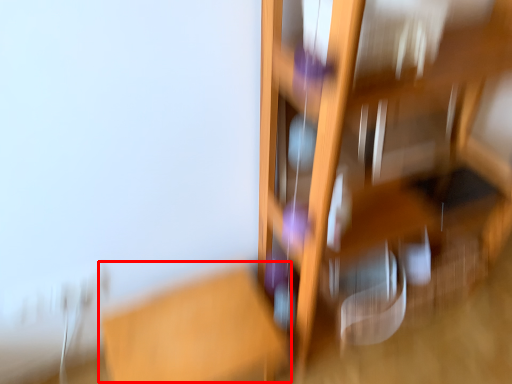
Question: Observing the image, what is the correct spatial positioning of table (annotated by the red box) in reference to furniture?

Choices:
 (A) left
 (B) right

Answer: (A)